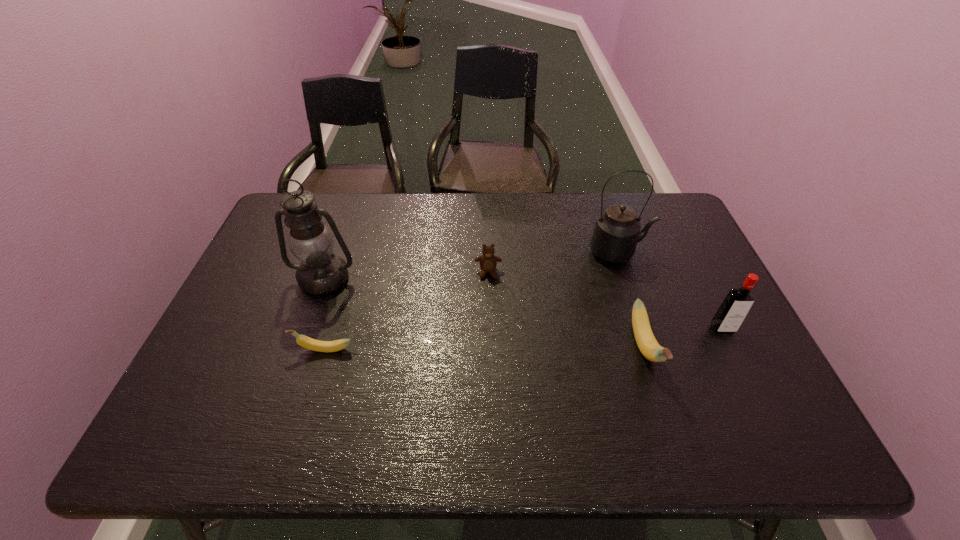
Where is `spot to insert another banana for uniform distribution`? The height and width of the screenshot is (540, 960). spot to insert another banana for uniform distribution is located at coordinates (485, 348).